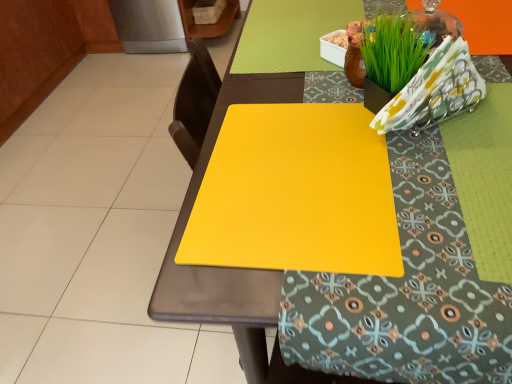
The width and height of the screenshot is (512, 384). In order to click on blank space above yellow matte cutting board at center (from a real-world perspective) in this screenshot , I will do `click(297, 173)`.